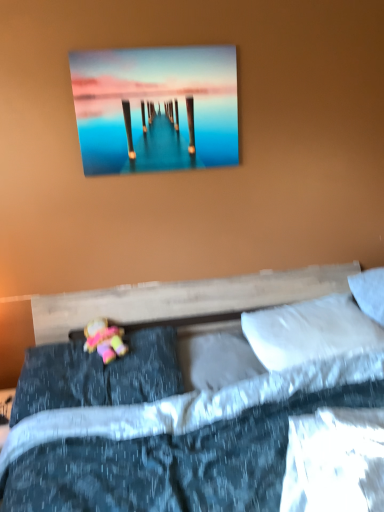
The height and width of the screenshot is (512, 384). Describe the element at coordinates (216, 360) in the screenshot. I see `white soft pillow at center, marked as the 3th pillow in a right-to-left arrangement` at that location.

What do you see at coordinates (310, 332) in the screenshot?
I see `white soft pillow at upper right, marked as the second pillow in a right-to-left arrangement` at bounding box center [310, 332].

Where is `dark blue textured pillow at lower left, placed as the 4th pillow when sorted from right to left`? dark blue textured pillow at lower left, placed as the 4th pillow when sorted from right to left is located at coordinates (98, 375).

Describe the element at coordinates (156, 108) in the screenshot. I see `metallic glossy pier at upper center` at that location.

The image size is (384, 512). I want to click on white soft pillow at center, which is the second pillow in left-to-right order, so click(216, 360).

How many degrees apart are the facing directions of white soft pillow at center, marked as the 3th pillow in a right-to-left arrangement, and white soft pillow at upper right, which ranks as the 3th pillow in left-to-right order?

They differ by 0.0012 degrees in their facing directions.

Is white soft pillow at center, marked as the 3th pillow in a right-to-left arrangement, not near white soft pillow at upper right, marked as the second pillow in a right-to-left arrangement?

No, there isn't a large distance between white soft pillow at center, marked as the 3th pillow in a right-to-left arrangement, and white soft pillow at upper right, marked as the second pillow in a right-to-left arrangement.

Is white soft pillow at center, marked as the 3th pillow in a right-to-left arrangement, turned away from white soft pillow at upper right, which ranks as the 3th pillow in left-to-right order?

No.

Based on the photo, which is more to the left, white soft pillow at center, marked as the 3th pillow in a right-to-left arrangement, or white soft pillow at upper right, which ranks as the 3th pillow in left-to-right order?

white soft pillow at center, marked as the 3th pillow in a right-to-left arrangement, is more to the left.

Is pastel fabric doll at lower left to the left of dark blue textured pillow at lower left, placed as the 4th pillow when sorted from right to left, from the viewer's perspective?

Yes.

Which of these two, pastel fabric doll at lower left or dark blue textured pillow at lower left, placed as the 4th pillow when sorted from right to left, is smaller?

With smaller size is pastel fabric doll at lower left.

From the image's perspective, is pastel fabric doll at lower left above dark blue textured pillow at lower left, placed as the 4th pillow when sorted from right to left?

Yes, from the image's perspective, pastel fabric doll at lower left is on top of dark blue textured pillow at lower left, placed as the 4th pillow when sorted from right to left.

How different are the orientations of pastel fabric doll at lower left and dark blue textured pillow at lower left, placed as the 4th pillow when sorted from right to left, in degrees?

They differ by 3.99 degrees in their facing directions.

Does white soft pillow at center, which is the second pillow in left-to-right order, turn towards dark blue textured pillow at lower left, placed as the 4th pillow when sorted from right to left?

No, white soft pillow at center, which is the second pillow in left-to-right order, is not aimed at dark blue textured pillow at lower left, placed as the 4th pillow when sorted from right to left.

Consider the image. Does white soft pillow at center, marked as the 3th pillow in a right-to-left arrangement, have a greater width compared to dark blue textured pillow at lower left, the 1th pillow in the left-to-right sequence?

No.

Is white soft pillow at center, marked as the 3th pillow in a right-to-left arrangement, bigger or smaller than dark blue textured pillow at lower left, the 1th pillow in the left-to-right sequence?

Considering their sizes, white soft pillow at center, marked as the 3th pillow in a right-to-left arrangement, takes up less space than dark blue textured pillow at lower left, the 1th pillow in the left-to-right sequence.

Is point (178, 343) more distant than point (45, 381)?

Yes, it is.

From a real-world perspective, is dark blue textured pillow at lower left, placed as the 4th pillow when sorted from right to left, beneath white soft pillow at center, which is the second pillow in left-to-right order?

No, from a real-world perspective, dark blue textured pillow at lower left, placed as the 4th pillow when sorted from right to left, is not under white soft pillow at center, which is the second pillow in left-to-right order.

This screenshot has width=384, height=512. What are the coordinates of `the 1st pillow positioned above the dark blue textured pillow at lower left, the 1th pillow in the left-to-right sequence (from the image's perspective)` in the screenshot? It's located at (216, 360).

Does point (51, 377) appear closer or farther from the camera than point (198, 349)?

Point (51, 377) is positioned closer to the camera compared to point (198, 349).

Considering the positions of objects dark blue textured pillow at lower left, placed as the 4th pillow when sorted from right to left, and white soft pillow at center, which is the second pillow in left-to-right order, in the image provided, who is more to the left, dark blue textured pillow at lower left, placed as the 4th pillow when sorted from right to left, or white soft pillow at center, which is the second pillow in left-to-right order,?

Positioned to the left is dark blue textured pillow at lower left, placed as the 4th pillow when sorted from right to left.

Which is closer to the camera, [122,355] or [357,284]?

Point [122,355].

Locate an element on the screen. The height and width of the screenshot is (512, 384). doll in front of the white soft pillow at right, which ranks as the fourth pillow in left-to-right order is located at coordinates (104, 340).

Can you confirm if pastel fabric doll at lower left is wider than white soft pillow at right, which ranks as the fourth pillow in left-to-right order?

Yes.

Between point (61, 380) and point (349, 311), which one is positioned behind?

The point (349, 311) is more distant.

Who is taller, dark blue textured pillow at lower left, the 1th pillow in the left-to-right sequence, or white soft pillow at upper right, marked as the second pillow in a right-to-left arrangement?

white soft pillow at upper right, marked as the second pillow in a right-to-left arrangement.

Considering the points (76, 97) and (367, 286), which point is in front, point (76, 97) or point (367, 286)?

Positioned in front is point (76, 97).

Based on the photo, considering the positions of objects metallic glossy pier at upper center and white soft pillow at right, which ranks as the fourth pillow in left-to-right order, in the image provided, who is in front, metallic glossy pier at upper center or white soft pillow at right, which ranks as the fourth pillow in left-to-right order,?

Positioned in front is metallic glossy pier at upper center.

Is there a large distance between metallic glossy pier at upper center and white soft pillow at right, marked as the 1th pillow in a right-to-left arrangement?

Indeed, metallic glossy pier at upper center is not near white soft pillow at right, marked as the 1th pillow in a right-to-left arrangement.

Is metallic glossy pier at upper center facing away from white soft pillow at right, marked as the 1th pillow in a right-to-left arrangement?

No, metallic glossy pier at upper center's orientation is not away from white soft pillow at right, marked as the 1th pillow in a right-to-left arrangement.

I want to click on pillow that is the 1st object located below the white soft pillow at upper right, marked as the second pillow in a right-to-left arrangement (from the image's perspective), so click(216, 360).

This screenshot has height=512, width=384. There is a pastel fabric doll at lower left. In order to click on the 2nd pillow below it (from a real-world perspective) in this screenshot , I will do `click(98, 375)`.

Looking at the image, which one is located further to dark blue textured pillow at lower left, placed as the 4th pillow when sorted from right to left, white soft pillow at center, which is the second pillow in left-to-right order, or pastel fabric doll at lower left?

The object further to dark blue textured pillow at lower left, placed as the 4th pillow when sorted from right to left, is white soft pillow at center, which is the second pillow in left-to-right order.

Estimate the real-world distances between objects in this image. Which object is closer to metallic glossy pier at upper center, pastel fabric doll at lower left or white soft pillow at center, which is the second pillow in left-to-right order?

The object closer to metallic glossy pier at upper center is pastel fabric doll at lower left.

Estimate the real-world distances between objects in this image. Which object is closer to white soft pillow at right, marked as the 1th pillow in a right-to-left arrangement, dark blue textured pillow at lower left, the 1th pillow in the left-to-right sequence, or white soft pillow at center, which is the second pillow in left-to-right order?

white soft pillow at center, which is the second pillow in left-to-right order, is positioned closer to the anchor white soft pillow at right, marked as the 1th pillow in a right-to-left arrangement.

In the scene shown: From the image, which object appears to be farther from white soft pillow at upper right, marked as the second pillow in a right-to-left arrangement, white soft pillow at right, which ranks as the fourth pillow in left-to-right order, or pastel fabric doll at lower left?

Based on the image, pastel fabric doll at lower left appears to be further to white soft pillow at upper right, marked as the second pillow in a right-to-left arrangement.

Which object lies nearer to the anchor point white soft pillow at right, marked as the 1th pillow in a right-to-left arrangement, white soft pillow at center, marked as the 3th pillow in a right-to-left arrangement, or metallic glossy pier at upper center?

white soft pillow at center, marked as the 3th pillow in a right-to-left arrangement, is closer to white soft pillow at right, marked as the 1th pillow in a right-to-left arrangement.

When comparing their distances from white soft pillow at center, which is the second pillow in left-to-right order, does pastel fabric doll at lower left or metallic glossy pier at upper center seem further?

metallic glossy pier at upper center is positioned further to the anchor white soft pillow at center, which is the second pillow in left-to-right order.

Looking at this image, estimate the real-world distances between objects in this image. Which object is further from white soft pillow at center, which is the second pillow in left-to-right order, white soft pillow at right, marked as the 1th pillow in a right-to-left arrangement, or white soft pillow at upper right, which ranks as the 3th pillow in left-to-right order?

white soft pillow at right, marked as the 1th pillow in a right-to-left arrangement, lies further to white soft pillow at center, which is the second pillow in left-to-right order, than the other object.

Estimate the real-world distances between objects in this image. Which object is closer to white soft pillow at center, marked as the 3th pillow in a right-to-left arrangement, metallic glossy pier at upper center or white soft pillow at upper right, which ranks as the 3th pillow in left-to-right order?

white soft pillow at upper right, which ranks as the 3th pillow in left-to-right order, is closer to white soft pillow at center, marked as the 3th pillow in a right-to-left arrangement.

At what (x,y) coordinates should I click in order to perform the action: click on pillow located between dark blue textured pillow at lower left, the 1th pillow in the left-to-right sequence, and white soft pillow at upper right, marked as the second pillow in a right-to-left arrangement, in the left-right direction. Please return your answer as a coordinate pair (x, y). This screenshot has width=384, height=512. Looking at the image, I should click on (216, 360).

Where is `doll that lies between metallic glossy pier at upper center and dark blue textured pillow at lower left, the 1th pillow in the left-to-right sequence, from top to bottom`? doll that lies between metallic glossy pier at upper center and dark blue textured pillow at lower left, the 1th pillow in the left-to-right sequence, from top to bottom is located at coordinates (104, 340).

Locate an element on the screen. This screenshot has width=384, height=512. pillow located between pastel fabric doll at lower left and white soft pillow at center, which is the second pillow in left-to-right order, in the left-right direction is located at coordinates (98, 375).

Where is `pillow between white soft pillow at center, which is the second pillow in left-to-right order, and white soft pillow at right, which ranks as the fourth pillow in left-to-right order`? pillow between white soft pillow at center, which is the second pillow in left-to-right order, and white soft pillow at right, which ranks as the fourth pillow in left-to-right order is located at coordinates (310, 332).